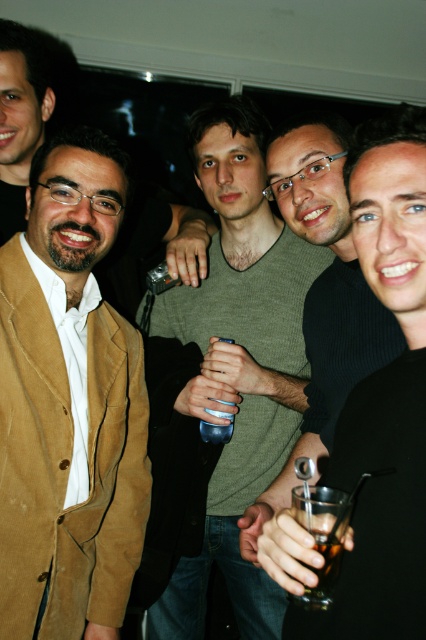
Is point (389, 186) behind point (334, 582)?

That is True.

Is the position of black matte glass at center more distant than that of translucent glass drink at center?

No, black matte glass at center is closer to the viewer.

Between point (382, 548) and point (327, 573), which one is positioned behind?

The point (327, 573) is more distant.

Find the location of `black matte glass at center`. black matte glass at center is located at coordinates (383, 396).

Measure the distance between suede tan jacket at left and green knitwear at center.

A distance of 34.17 centimeters exists between suede tan jacket at left and green knitwear at center.

Does point (91, 316) come closer to viewer compared to point (210, 179)?

Yes, point (91, 316) is in front of point (210, 179).

Is point (88, 624) farther from camera compared to point (261, 621)?

No.

The height and width of the screenshot is (640, 426). Identify the location of suede tan jacket at left. (69, 410).

Is point (63, 502) less distant than point (420, 248)?

No, (63, 502) is further to viewer.

Who is more distant from viewer, (83, 378) or (351, 160)?

Point (83, 378)

Find the location of a particular element. suede tan jacket at left is located at coordinates (69, 410).

Find the location of a particular element. The image size is (426, 640). suede tan jacket at left is located at coordinates (69, 410).